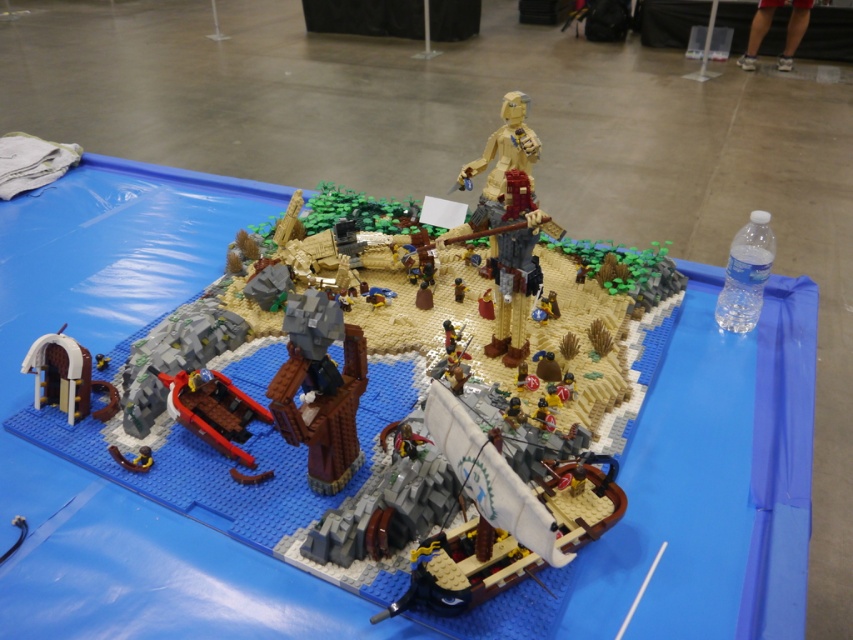
Is brown wooden archway at lower left behind metallic blue sword at lower left?

Yes.

Looking at this image, who is positioned more to the left, brown wooden archway at lower left or metallic blue sword at lower left?

brown wooden archway at lower left

Where is `brown wooden archway at lower left`? The image size is (853, 640). brown wooden archway at lower left is located at coordinates (67, 378).

Who is higher up, dark brown wood tree trunk at center or brown wooden archway at lower left?

brown wooden archway at lower left

The height and width of the screenshot is (640, 853). What do you see at coordinates (320, 388) in the screenshot?
I see `dark brown wood tree trunk at center` at bounding box center [320, 388].

Find the location of `dark brown wood tree trunk at center`. dark brown wood tree trunk at center is located at coordinates (320, 388).

Where is `dark brown wood tree trunk at center`? dark brown wood tree trunk at center is located at coordinates (320, 388).

Can you confirm if dark brown wood tree trunk at center is smaller than metallic blue sword at lower left?

Incorrect, dark brown wood tree trunk at center is not smaller in size than metallic blue sword at lower left.

Does point (334, 385) come closer to viewer compared to point (113, 456)?

Yes.

Between point (289, 337) and point (114, 456), which one is positioned behind?

Point (114, 456)

This screenshot has height=640, width=853. Identify the location of dark brown wood tree trunk at center. (320, 388).